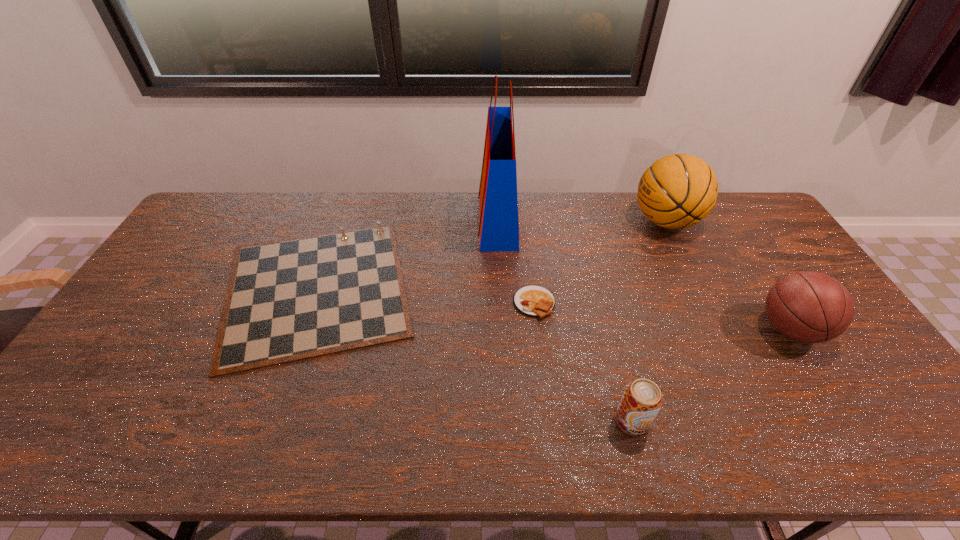
Find the location of a particular element. This screenshot has height=540, width=960. shopping bag is located at coordinates (498, 213).

Locate an element on the screen. the fifth shortest object is located at coordinates (677, 191).

The image size is (960, 540). What are the coordinates of `the farther basketball` in the screenshot? It's located at (677, 191).

Locate an element on the screen. This screenshot has height=540, width=960. the nearer basketball is located at coordinates [x=810, y=307].

The width and height of the screenshot is (960, 540). Find the location of `the third tallest object`. the third tallest object is located at coordinates point(810,307).

You are a GUI agent. You are given a task and a screenshot of the screen. Output one action in this format:
    pyautogui.click(x=<x>, y=<y>)
    Task: Click on the fourth object from left to right
    The height and width of the screenshot is (540, 960).
    Given the screenshot: What is the action you would take?
    pyautogui.click(x=641, y=401)

At what (x,y) coordinates should I click in order to perform the action: click on the fourth tallest object. Please return your answer as a coordinate pair (x, y). Looking at the image, I should click on (641, 401).

Where is `gameboard`? The width and height of the screenshot is (960, 540). gameboard is located at coordinates (291, 299).

Locate an element on the screen. the leftmost object is located at coordinates pyautogui.click(x=291, y=299).

The width and height of the screenshot is (960, 540). What are the coordinates of `the shortest object` in the screenshot? It's located at (534, 301).